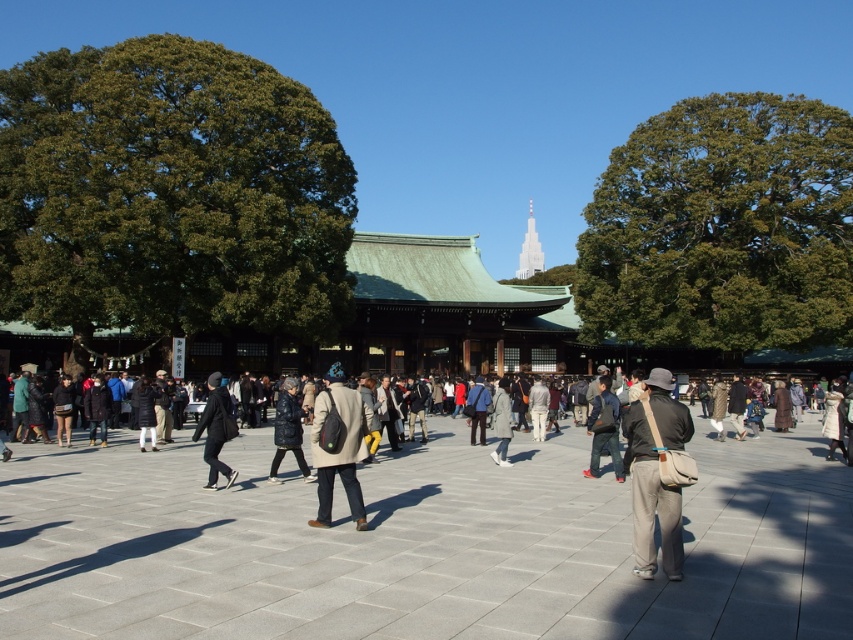
Question: Among these points, which one is farthest from the camera?

Choices:
 (A) [x=643, y=442]
 (B) [x=202, y=428]

Answer: (B)

Question: In this image, where is matte black backpack at center located relative to dark gray fabric jacket at center?

Choices:
 (A) left
 (B) right

Answer: (B)

Question: In this image, where is khaki canvas bag at center located relative to matte black backpack at center?

Choices:
 (A) above
 (B) below

Answer: (B)

Question: Considering the relative positions of khaki canvas bag at center and matte black backpack at center in the image provided, where is khaki canvas bag at center located with respect to matte black backpack at center?

Choices:
 (A) right
 (B) left

Answer: (A)

Question: Based on their relative distances, which object is farther from the matte black backpack at center?

Choices:
 (A) dark gray fabric jacket at center
 (B) khaki canvas bag at center

Answer: (B)

Question: Considering the real-world distances, which object is farthest from the khaki canvas bag at center?

Choices:
 (A) matte black backpack at center
 (B) dark gray fabric jacket at center

Answer: (B)